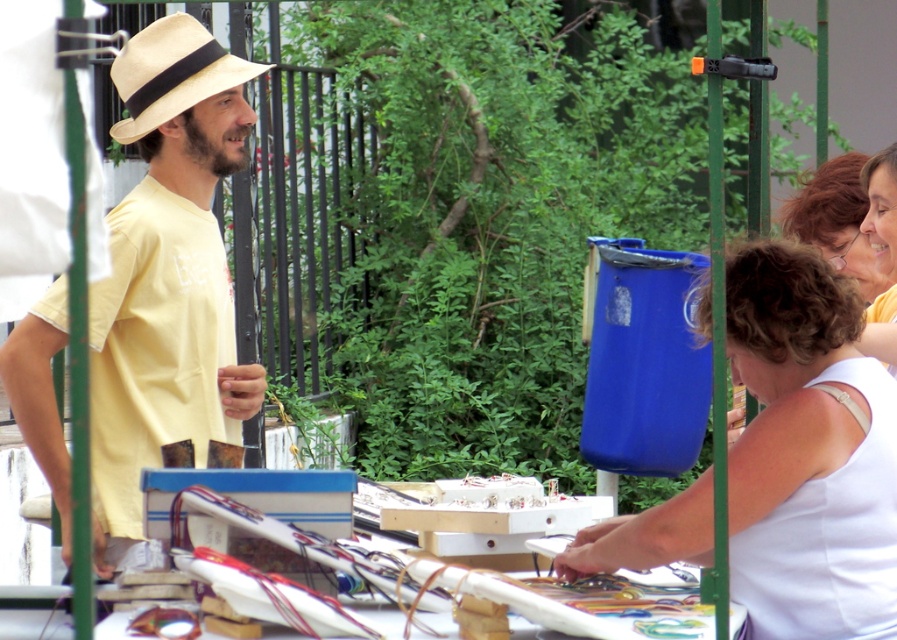
Is white matte tank top at right to the right of natural straw hat at center from the viewer's perspective?

Yes, white matte tank top at right is to the right of natural straw hat at center.

Who is taller, white matte tank top at right or natural straw hat at center?

white matte tank top at right

Locate an element on the screen. white matte tank top at right is located at coordinates (808, 452).

Who is higher up, matte yellow t-shirt at left or natural straw hat at center?

natural straw hat at center is higher up.

Who is positioned more to the right, matte yellow t-shirt at left or natural straw hat at center?

Positioned to the right is natural straw hat at center.

Which is in front, point (119, 236) or point (263, 68)?

Positioned in front is point (119, 236).

Image resolution: width=897 pixels, height=640 pixels. I want to click on matte yellow t-shirt at left, so click(167, 275).

Does point (189, 428) come farther from viewer compared to point (817, 604)?

Yes, point (189, 428) is farther from viewer.

Which of these two, matte yellow t-shirt at left or white matte tank top at right, stands taller?

Standing taller between the two is matte yellow t-shirt at left.

Who is more distant from viewer, (129, 305) or (799, 529)?

The point (129, 305) is behind.

You are a GUI agent. You are given a task and a screenshot of the screen. Output one action in this format:
    pyautogui.click(x=<x>, y=<y>)
    Task: Click on the matte yellow t-shirt at left
    The width and height of the screenshot is (897, 640).
    Given the screenshot: What is the action you would take?
    pyautogui.click(x=167, y=275)